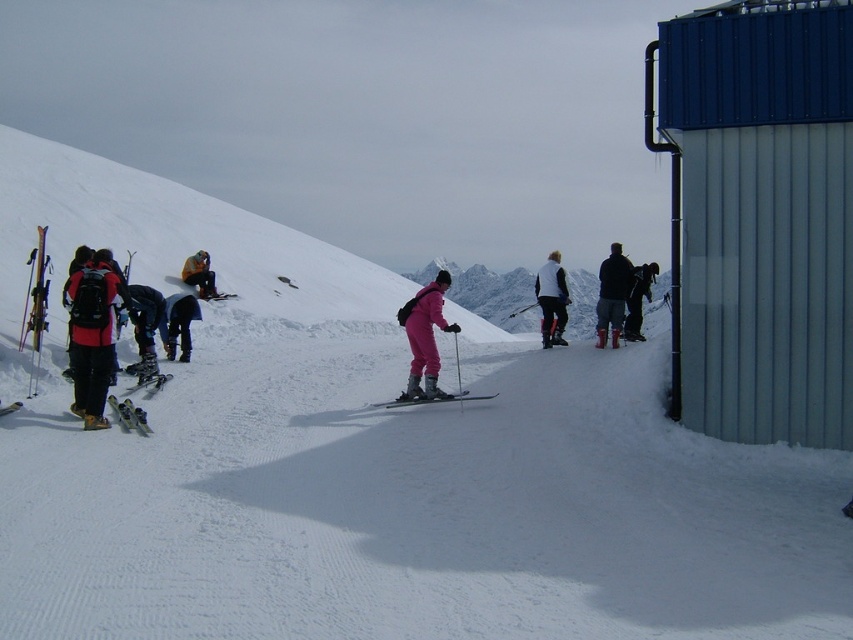
Question: Which object appears closest to the camera in this image?

Choices:
 (A) yellow-orange jacket at center
 (B) dark blue ski pants at left
 (C) dark gray pants at center right
 (D) pink matte ski suit at center

Answer: (D)

Question: Which object appears closest to the camera in this image?

Choices:
 (A) pink matte snowboard at center
 (B) matte black ski boots at left
 (C) dark gray pants at center right
 (D) dark blue ski pants at center

Answer: (A)

Question: Which object is positioned closest to the matte black skis at lower left?

Choices:
 (A) matte black ski boots at left
 (B) dark gray pants at center right
 (C) pink matte ski suit at center
 (D) matte black backpack at left

Answer: (D)

Question: Does pink matte ski suit at center come behind matte black skis at center?

Choices:
 (A) no
 (B) yes

Answer: (A)

Question: Can you confirm if dark blue ski pants at center is wider than matte black skis at lower left?

Choices:
 (A) yes
 (B) no

Answer: (A)

Question: Is pink matte ski suit at center bigger than dark blue ski pants at center?

Choices:
 (A) yes
 (B) no

Answer: (B)